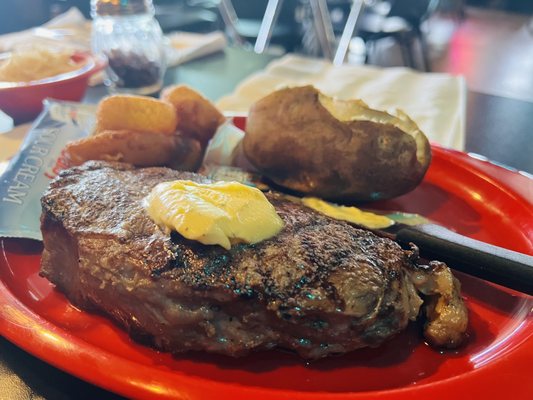
The image size is (533, 400). What are the coordinates of `chair` in the screenshot? It's located at pyautogui.click(x=309, y=32).